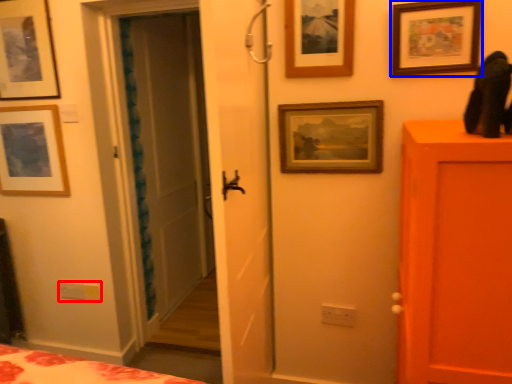
Question: Which object is further to the camera taking this photo, light switch (highlighted by a red box) or picture frame (highlighted by a blue box)?

Choices:
 (A) light switch
 (B) picture frame

Answer: (A)